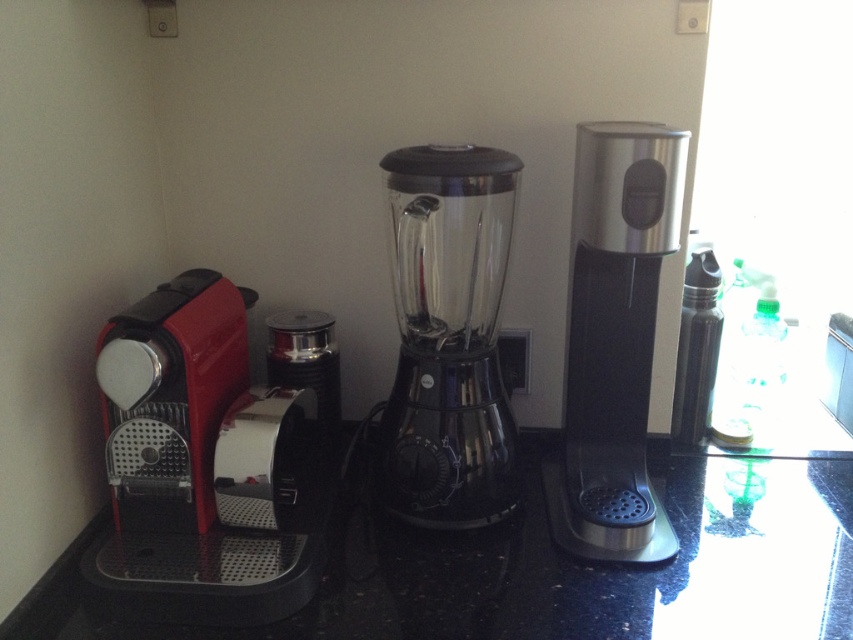
Question: From the image, what is the correct spatial relationship of shiny red coffee machine at left in relation to polished stainless steel coffee machine at right?

Choices:
 (A) below
 (B) above

Answer: (A)

Question: Which of the following is the closest to the observer?

Choices:
 (A) shiny red coffee machine at left
 (B) polished stainless steel coffee machine at right

Answer: (A)

Question: Does black glossy countertop at lower left have a larger size compared to polished stainless steel coffee machine at right?

Choices:
 (A) yes
 (B) no

Answer: (A)

Question: Is black glossy countertop at lower left bigger than transparent glass blender at center?

Choices:
 (A) yes
 (B) no

Answer: (A)

Question: Which of the following is the closest to the observer?

Choices:
 (A) (451, 605)
 (B) (486, 362)
 (C) (167, 600)
 (D) (596, 497)

Answer: (C)

Question: Estimate the real-world distances between objects in this image. Which object is closer to the transparent glass blender at center?

Choices:
 (A) polished stainless steel coffee machine at right
 (B) shiny red coffee machine at left
 (C) black glossy countertop at lower left

Answer: (A)